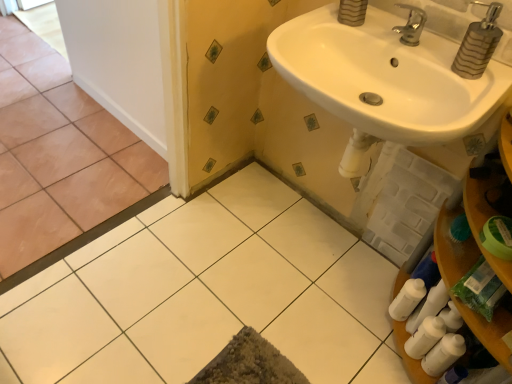
This screenshot has width=512, height=384. Identify the location of silver metallic faucet at upper right. (411, 25).

What do you see at coordinates (411, 25) in the screenshot? I see `silver metallic faucet at upper right` at bounding box center [411, 25].

Locate an element on the screen. This screenshot has height=384, width=512. white glossy tile at center, marked as the 2th ceramic tile in a left-to-right arrangement is located at coordinates (206, 294).

Find the location of a particular element. Image resolution: width=512 pixels, height=384 pixels. metallic striped soap dispenser at upper right is located at coordinates point(478,44).

Is metallic striped soap dispenser at upper right to the left or to the right of brown matte tile at left, which appears as the 1th ceramic tile when viewed from the left, in the image?

From the image, it's evident that metallic striped soap dispenser at upper right is to the right of brown matte tile at left, which appears as the 1th ceramic tile when viewed from the left.

Would you say metallic striped soap dispenser at upper right is inside or outside brown matte tile at left, which appears as the 1th ceramic tile when viewed from the left?

metallic striped soap dispenser at upper right is located beyond the bounds of brown matte tile at left, which appears as the 1th ceramic tile when viewed from the left.

Are metallic striped soap dispenser at upper right and brown matte tile at left, which appears as the 1th ceramic tile when viewed from the left, beside each other?

No, metallic striped soap dispenser at upper right is not making contact with brown matte tile at left, which appears as the 1th ceramic tile when viewed from the left.

Is metallic striped soap dispenser at upper right aimed at brown matte tile at left, arranged as the second ceramic tile when viewed from the right?

No, metallic striped soap dispenser at upper right is not aimed at brown matte tile at left, arranged as the second ceramic tile when viewed from the right.

In the scene shown: Considering the relative sizes of metallic striped soap dispenser at upper right and white glossy tile at center, the 1th ceramic tile when ordered from right to left, in the image provided, is metallic striped soap dispenser at upper right thinner than white glossy tile at center, the 1th ceramic tile when ordered from right to left,?

Yes, metallic striped soap dispenser at upper right is thinner than white glossy tile at center, the 1th ceramic tile when ordered from right to left.

Could you tell me if metallic striped soap dispenser at upper right is facing white glossy tile at center, marked as the 2th ceramic tile in a left-to-right arrangement?

No, metallic striped soap dispenser at upper right is not turned towards white glossy tile at center, marked as the 2th ceramic tile in a left-to-right arrangement.

Is metallic striped soap dispenser at upper right directly adjacent to white glossy tile at center, the 1th ceramic tile when ordered from right to left?

No, metallic striped soap dispenser at upper right is not with white glossy tile at center, the 1th ceramic tile when ordered from right to left.

From the picture: Would you say metallic striped soap dispenser at upper right contains white glossy tile at center, the 1th ceramic tile when ordered from right to left?

No, white glossy tile at center, the 1th ceramic tile when ordered from right to left, is not surrounded by metallic striped soap dispenser at upper right.

From the image's perspective, who appears lower, white glossy sink at upper right or metallic striped soap dispenser at upper right?

From the image's view, white glossy sink at upper right is below.

Which point is more forward, (x=400, y=49) or (x=484, y=26)?

The point (x=484, y=26) is closer.

Which object is positioned more to the left, white glossy sink at upper right or metallic striped soap dispenser at upper right?

white glossy sink at upper right is more to the left.

Is white glossy sink at upper right positioned far away from metallic striped soap dispenser at upper right?

No, there isn't a large distance between white glossy sink at upper right and metallic striped soap dispenser at upper right.

Between white glossy sink at upper right and white glossy tile at center, the 1th ceramic tile when ordered from right to left, which one has less height?

white glossy tile at center, the 1th ceramic tile when ordered from right to left, is shorter.

In the scene shown: Which is more to the right, white glossy sink at upper right or white glossy tile at center, the 1th ceramic tile when ordered from right to left?

white glossy sink at upper right is more to the right.

Considering the sizes of white glossy sink at upper right and white glossy tile at center, the 1th ceramic tile when ordered from right to left, in the image, is white glossy sink at upper right wider or thinner than white glossy tile at center, the 1th ceramic tile when ordered from right to left,?

Clearly, white glossy sink at upper right has less width compared to white glossy tile at center, the 1th ceramic tile when ordered from right to left.

Is point (304, 21) closer to camera compared to point (326, 276)?

Yes, it is.

Is point (405, 31) less distant than point (490, 33)?

No, (405, 31) is further to viewer.

Between silver metallic faucet at upper right and metallic striped soap dispenser at upper right, which one has larger size?

metallic striped soap dispenser at upper right.

Is silver metallic faucet at upper right positioned behind metallic striped soap dispenser at upper right?

Yes.

Looking at this image, are silver metallic faucet at upper right and metallic striped soap dispenser at upper right beside each other?

silver metallic faucet at upper right is not next to metallic striped soap dispenser at upper right, and they're not touching.

Does brown matte tile at left, arranged as the second ceramic tile when viewed from the right, appear on the left side of silver metallic faucet at upper right?

Yes, brown matte tile at left, arranged as the second ceramic tile when viewed from the right, is to the left of silver metallic faucet at upper right.

Could you tell me if brown matte tile at left, which appears as the 1th ceramic tile when viewed from the left, is turned towards silver metallic faucet at upper right?

No, brown matte tile at left, which appears as the 1th ceramic tile when viewed from the left, is not facing towards silver metallic faucet at upper right.

Who is smaller, brown matte tile at left, arranged as the second ceramic tile when viewed from the right, or silver metallic faucet at upper right?

silver metallic faucet at upper right.

Looking at this image, which is closer, (60, 63) or (406, 35)?

Point (60, 63) is positioned farther from the camera compared to point (406, 35).

Would you say white glossy sink at upper right is inside or outside brown matte tile at left, arranged as the second ceramic tile when viewed from the right?

white glossy sink at upper right exists outside the volume of brown matte tile at left, arranged as the second ceramic tile when viewed from the right.

Which object is closer to the camera taking this photo, white glossy sink at upper right or brown matte tile at left, arranged as the second ceramic tile when viewed from the right?

white glossy sink at upper right is more forward.

Does point (392, 19) lie behind point (32, 76)?

No, it is in front of (32, 76).

From the picture: Is white glossy sink at upper right oriented towards brown matte tile at left, which appears as the 1th ceramic tile when viewed from the left?

No, white glossy sink at upper right is not turned towards brown matte tile at left, which appears as the 1th ceramic tile when viewed from the left.

Where is `ceramic tile located above the metallic striped soap dispenser at upper right (from the image's perspective)`? The width and height of the screenshot is (512, 384). ceramic tile located above the metallic striped soap dispenser at upper right (from the image's perspective) is located at coordinates (59, 154).

At what (x,y) coordinates should I click in order to perform the action: click on ceramic tile in front of the metallic striped soap dispenser at upper right. Please return your answer as a coordinate pair (x, y). The height and width of the screenshot is (384, 512). Looking at the image, I should click on (206, 294).

Looking at the image, which one is located closer to white glossy sink at upper right, metallic striped soap dispenser at upper right or white glossy tile at center, marked as the 2th ceramic tile in a left-to-right arrangement?

Among the two, metallic striped soap dispenser at upper right is located nearer to white glossy sink at upper right.

Looking at the image, which one is located further to white glossy tile at center, the 1th ceramic tile when ordered from right to left, silver metallic faucet at upper right or brown matte tile at left, which appears as the 1th ceramic tile when viewed from the left?

silver metallic faucet at upper right.

Based on their spatial positions, is metallic striped soap dispenser at upper right or brown matte tile at left, arranged as the second ceramic tile when viewed from the right, closer to white glossy tile at center, the 1th ceramic tile when ordered from right to left?

brown matte tile at left, arranged as the second ceramic tile when viewed from the right, lies closer to white glossy tile at center, the 1th ceramic tile when ordered from right to left, than the other object.

Which object lies nearer to the anchor point white glossy tile at center, marked as the 2th ceramic tile in a left-to-right arrangement, brown matte tile at left, arranged as the second ceramic tile when viewed from the right, or metallic striped soap dispenser at upper right?

brown matte tile at left, arranged as the second ceramic tile when viewed from the right, is positioned closer to the anchor white glossy tile at center, marked as the 2th ceramic tile in a left-to-right arrangement.

Estimate the real-world distances between objects in this image. Which object is further from silver metallic faucet at upper right, white glossy tile at center, marked as the 2th ceramic tile in a left-to-right arrangement, or white glossy sink at upper right?

Based on the image, white glossy tile at center, marked as the 2th ceramic tile in a left-to-right arrangement, appears to be further to silver metallic faucet at upper right.

Estimate the real-world distances between objects in this image. Which object is closer to white glossy tile at center, the 1th ceramic tile when ordered from right to left, brown matte tile at left, which appears as the 1th ceramic tile when viewed from the left, or silver metallic faucet at upper right?

brown matte tile at left, which appears as the 1th ceramic tile when viewed from the left, lies closer to white glossy tile at center, the 1th ceramic tile when ordered from right to left, than the other object.

Based on their spatial positions, is brown matte tile at left, which appears as the 1th ceramic tile when viewed from the left, or silver metallic faucet at upper right further from white glossy sink at upper right?

Among the two, brown matte tile at left, which appears as the 1th ceramic tile when viewed from the left, is located further to white glossy sink at upper right.

Looking at the image, which one is located closer to metallic striped soap dispenser at upper right, white glossy sink at upper right or white glossy tile at center, marked as the 2th ceramic tile in a left-to-right arrangement?

white glossy sink at upper right is closer to metallic striped soap dispenser at upper right.

Where is `tap located between white glossy sink at upper right and metallic striped soap dispenser at upper right in the left-right direction`? This screenshot has height=384, width=512. tap located between white glossy sink at upper right and metallic striped soap dispenser at upper right in the left-right direction is located at coordinates (411, 25).

Locate an element on the screen. The height and width of the screenshot is (384, 512). sink that lies between metallic striped soap dispenser at upper right and white glossy tile at center, the 1th ceramic tile when ordered from right to left, from top to bottom is located at coordinates (385, 77).

Identify the location of tap between brown matte tile at left, arranged as the second ceramic tile when viewed from the right, and metallic striped soap dispenser at upper right. (411, 25).

You are a GUI agent. You are given a task and a screenshot of the screen. Output one action in this format:
    pyautogui.click(x=<x>, y=<y>)
    Task: Click on the sink between brown matte tile at left, which appears as the 1th ceramic tile when viewed from the left, and metallic striped soap dispenser at upper right
    
    Given the screenshot: What is the action you would take?
    pyautogui.click(x=385, y=77)